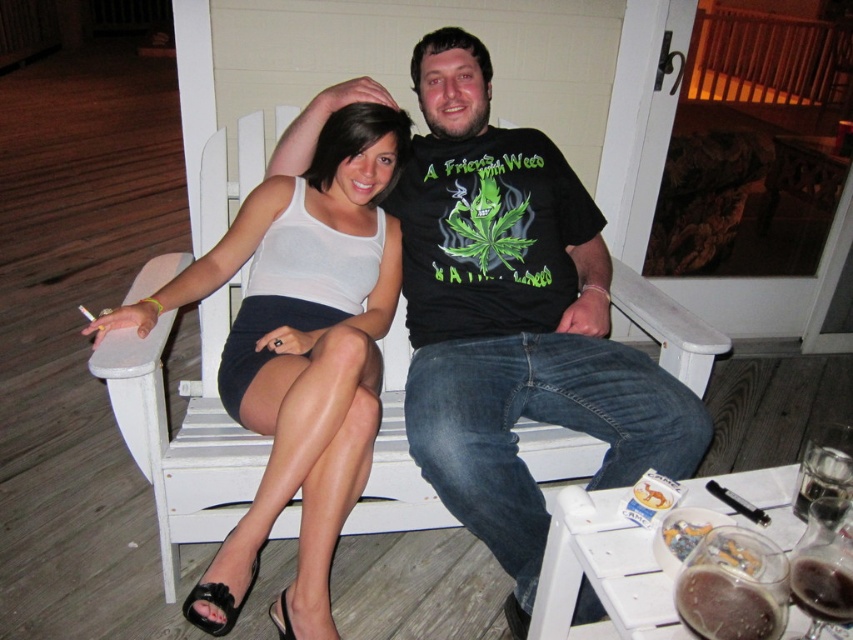
Who is positioned more to the left, black matte t-shirt at center or white matte tank top at center?

From the viewer's perspective, white matte tank top at center appears more on the left side.

Is point (457, 296) positioned before point (339, 252)?

No, (457, 296) is further to viewer.

The image size is (853, 640). Identify the location of black matte t-shirt at center. (514, 320).

Does black matte t-shirt at center appear under translucent glass beer at lower right?

No, black matte t-shirt at center is not below translucent glass beer at lower right.

Who is more forward, [537,186] or [817,563]?

Point [817,563]

Find the location of a particular element. This screenshot has height=640, width=853. black matte t-shirt at center is located at coordinates (514, 320).

Between white matte tank top at center and translucent glass beer at lower right, which one is positioned higher?

white matte tank top at center is higher up.

Which of these two, white matte tank top at center or translucent glass beer at lower right, stands shorter?

Standing shorter between the two is translucent glass beer at lower right.

You are a GUI agent. You are given a task and a screenshot of the screen. Output one action in this format:
    pyautogui.click(x=<x>, y=<y>)
    Task: Click on the white matte tank top at center
    This screenshot has height=640, width=853.
    Given the screenshot: What is the action you would take?
    pyautogui.click(x=299, y=353)